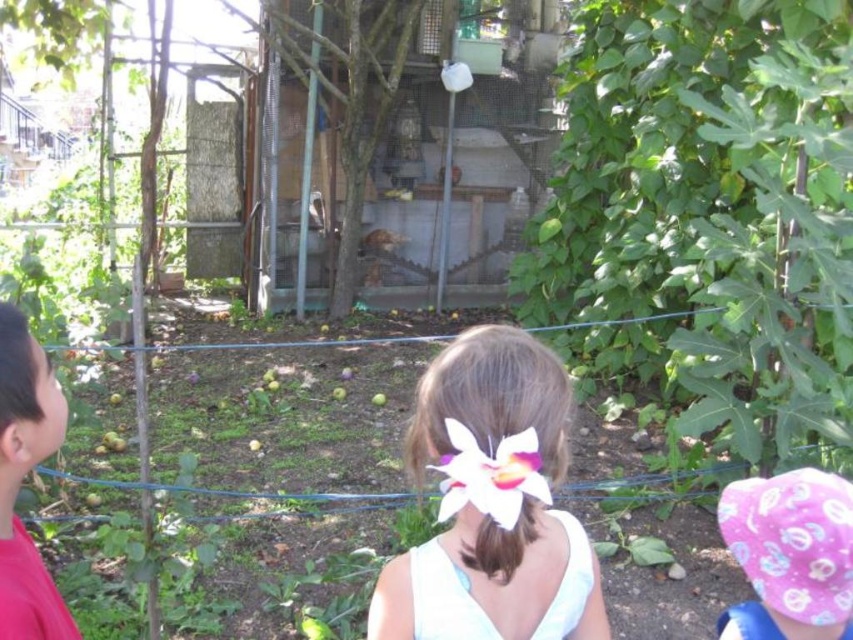
Is point (445, 545) farther from camera compared to point (843, 518)?

No, it is in front of (843, 518).

I want to click on white fabric flower at center, so point(492,502).

Between pink fabric hat at lower right and red shirt at left, which one is positioned higher?

red shirt at left

This screenshot has width=853, height=640. What do you see at coordinates (793, 547) in the screenshot?
I see `pink fabric hat at lower right` at bounding box center [793, 547].

In order to click on pink fabric hat at lower right in this screenshot , I will do `click(793, 547)`.

Between pink fabric hat at lower right and white matte flower at center, which one is positioned lower?

pink fabric hat at lower right is lower down.

In the scene shown: Is pink fabric hat at lower right positioned in front of white matte flower at center?

No.

Which is behind, point (840, 525) or point (526, 477)?

The point (840, 525) is more distant.

Find the location of `pink fabric hat at lower right`. pink fabric hat at lower right is located at coordinates (793, 547).